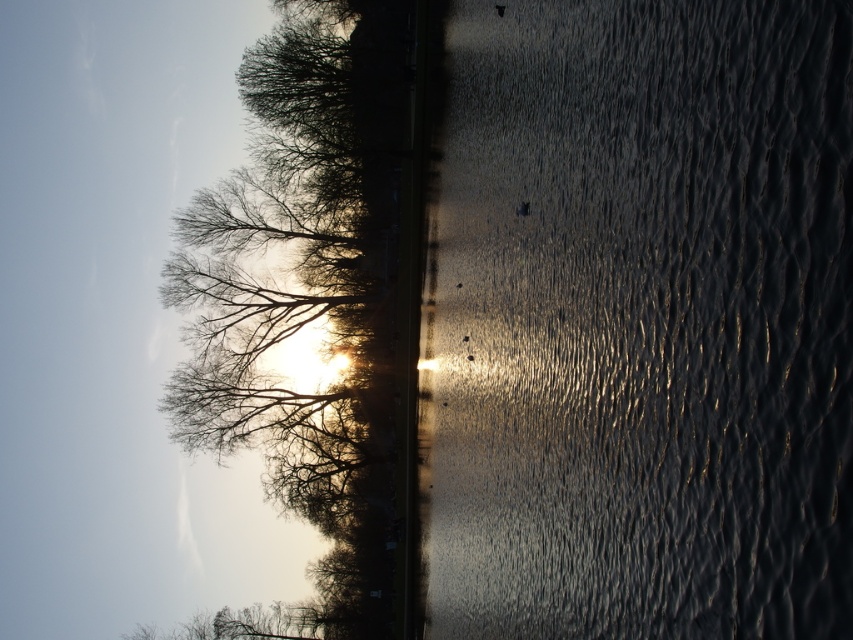
You are an artist sketching the lakeside scene. You want to place the silvery branches at upper left accurately on your drawing. What are their coordinates?

The silvery branches at upper left are located at coordinates point (309, 291).

You are an artist planning to paint the lakeside scene. You want to ensure the silvery branches at upper left and the bare branches at lower left are proportionally accurate. Which of these branches has a narrower width in the painting?

The silvery branches at upper left has a narrower width compared to the bare branches at lower left.